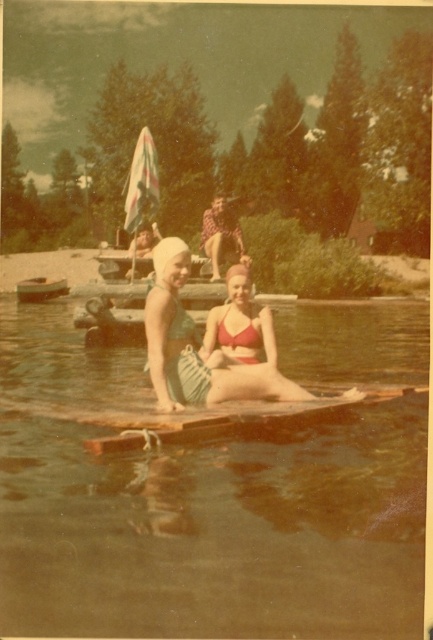
Consider the image. You are a photographer standing on the dock and want to capture both the clear water at center and the green striped swimsuit at center in a single shot. Given that your camera has a maximum focus range of 6 feet, will you be able to capture both subjects clearly?

The clear water at center and the green striped swimsuit at center are 6.64 feet apart. Since the distance between them exceeds the camera maximum focus range of 6 feet, you won not be able to capture both subjects clearly in a single shot.

You are a photographer standing on the wooden dock where the two women are sitting. You want to capture a photo that includes both the clear water at center and the wooden boat at lower left in the same frame. Given the distance between them, do you think you can fit both into your camera view without moving your position?

The clear water at center and wooden boat at lower left are 21.23 meters apart from each other. Since the camera can typically capture a wide enough angle to include objects 21.23 meters apart when positioned centrally, you can likely fit both into the frame without moving.

You are a photographer trying to capture a clear shot of the matte red bikini at center and the wooden boat at lower left. Since you want both subjects to appear proportionally sized in the photo, which object should you move closer to and which should you move farther away?

To make both the matte red bikini at center and the wooden boat at lower left appear proportionally sized in the photo, you should move closer to the wooden boat at lower left and move farther away from the matte red bikini at center. This is because the matte red bikini at center is currently larger in size than the wooden boat at lower left, so reducing its size in the frame and enlarging the boat would balance their sizes.